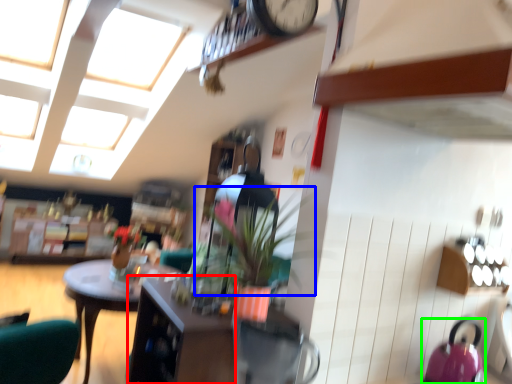
Question: Which is nearer to the cabinetry (highlighted by a red box)? plant (highlighted by a blue box) or kettle (highlighted by a green box).

Choices:
 (A) plant
 (B) kettle

Answer: (A)